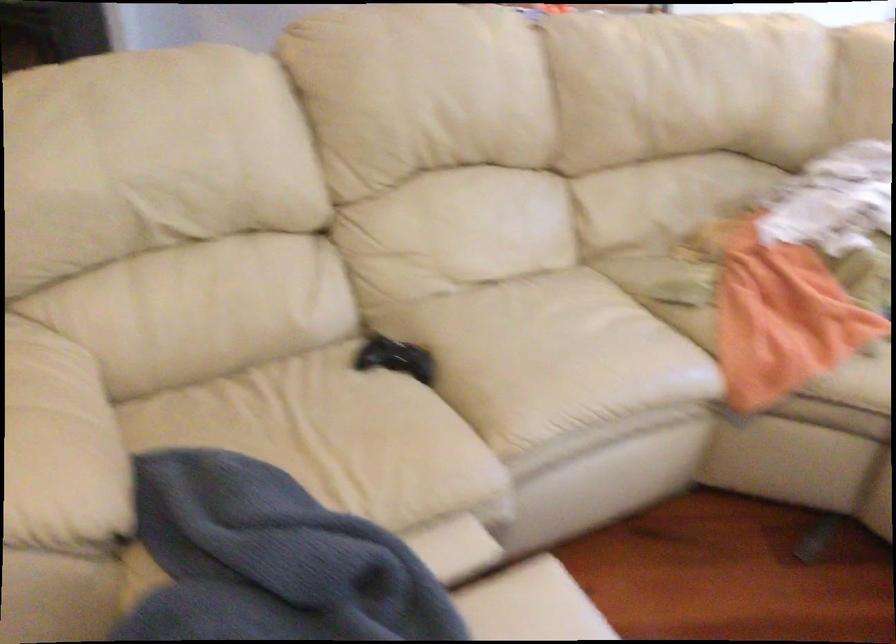
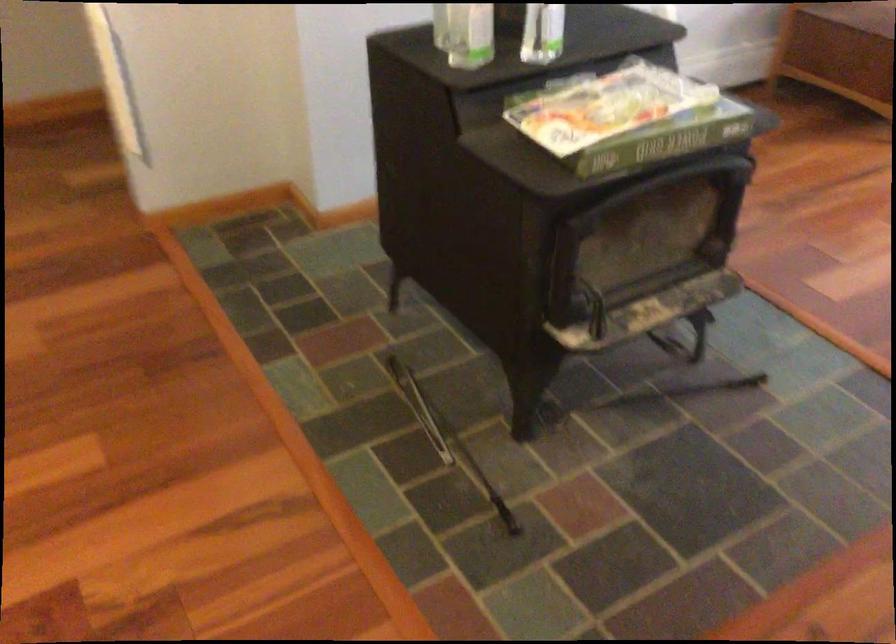
What movement of the cameraman would produce the second image?

The cameraman walked toward left, forward.